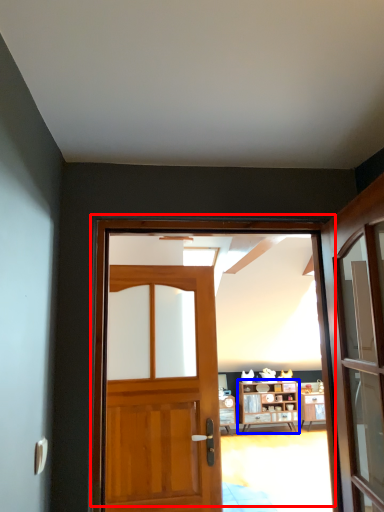
Question: Which of the following is the farthest to the observer, door (highlighted by a red box) or cabinetry (highlighted by a blue box)?

Choices:
 (A) door
 (B) cabinetry

Answer: (B)